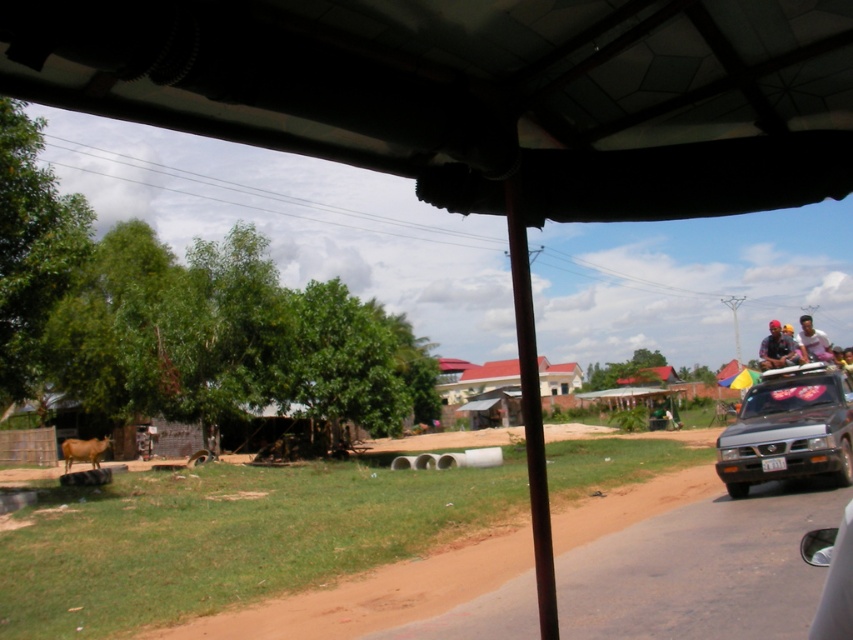
Question: From the image, what is the correct spatial relationship of brown dirt track at lower left in relation to red corrugated metal hut at center?

Choices:
 (A) below
 (B) above

Answer: (B)

Question: Is brown matte cow at lower left bigger than pink fabric at upper right?

Choices:
 (A) yes
 (B) no

Answer: (B)

Question: In this image, where is yellow fabric hat at upper right located relative to pink fabric at upper right?

Choices:
 (A) left
 (B) right

Answer: (A)

Question: Which object is closer to the camera taking this photo?

Choices:
 (A) brown dirt track at lower left
 (B) transparent plastic canopy at upper center
 (C) yellow fabric hat at upper right

Answer: (B)

Question: Estimate the real-world distances between objects in this image. Which object is closer to the transparent plastic canopy at upper center?

Choices:
 (A) brown dirt track at lower left
 (B) red corrugated metal hut at center
 (C) pink fabric at upper right
 (D) transparent glass car window at lower right

Answer: (D)

Question: Considering the real-world distances, which object is farthest from the brown matte cow at lower left?

Choices:
 (A) transparent plastic canopy at upper center
 (B) silver metallic jeep at right

Answer: (B)